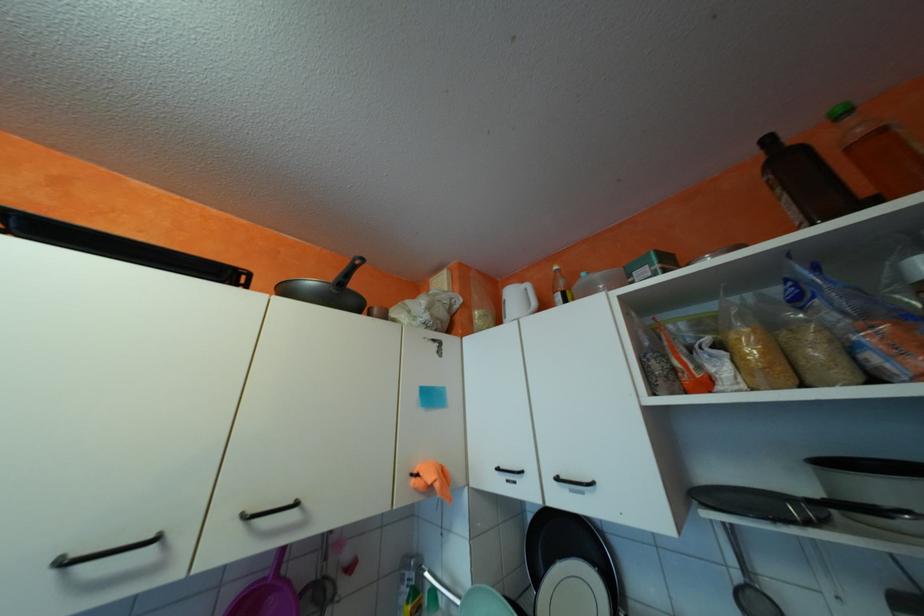
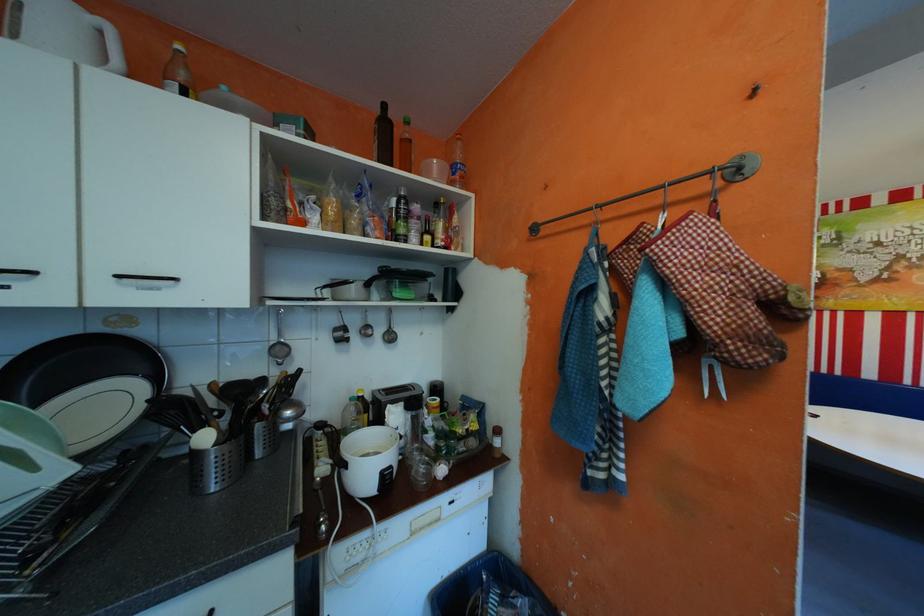
Find the pixel in the second image that matches point (568, 477) in the first image.

(130, 275)